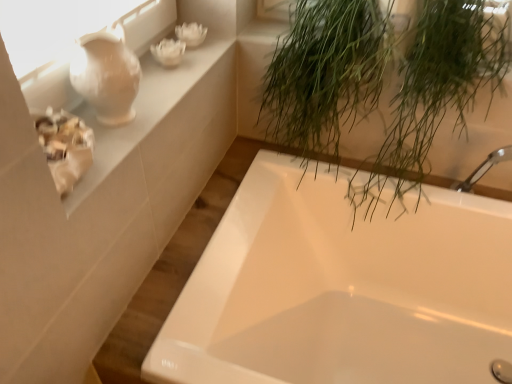
Question: Considering the relative sizes of matte white vase at upper left and white glossy bathtub at center in the image provided, is matte white vase at upper left taller than white glossy bathtub at center?

Choices:
 (A) yes
 (B) no

Answer: (B)

Question: From the image's perspective, is matte white vase at upper left located above white glossy bathtub at center?

Choices:
 (A) no
 (B) yes

Answer: (B)

Question: Is matte white vase at upper left to the right of white glossy bathtub at center from the viewer's perspective?

Choices:
 (A) yes
 (B) no

Answer: (B)

Question: Does matte white vase at upper left have a lesser height compared to white glossy bathtub at center?

Choices:
 (A) no
 (B) yes

Answer: (B)

Question: Is matte white vase at upper left smaller than white glossy bathtub at center?

Choices:
 (A) no
 (B) yes

Answer: (B)

Question: In the image, is white glossy bathtub at center positioned in front of or behind white ceramic vase at upper left?

Choices:
 (A) behind
 (B) front

Answer: (B)

Question: Considering the positions of white glossy bathtub at center and white ceramic vase at upper left in the image, is white glossy bathtub at center taller or shorter than white ceramic vase at upper left?

Choices:
 (A) short
 (B) tall

Answer: (B)

Question: Looking at the image, does white glossy bathtub at center seem bigger or smaller compared to white ceramic vase at upper left?

Choices:
 (A) small
 (B) big

Answer: (B)

Question: From the image's perspective, is white glossy bathtub at center above or below white ceramic vase at upper left?

Choices:
 (A) above
 (B) below

Answer: (B)

Question: From a real-world perspective, is green leafy plant at upper right positioned above or below white ceramic vase at upper left?

Choices:
 (A) below
 (B) above

Answer: (A)

Question: In terms of height, does green leafy plant at upper right look taller or shorter compared to white ceramic vase at upper left?

Choices:
 (A) tall
 (B) short

Answer: (A)

Question: Looking at their shapes, would you say green leafy plant at upper right is wider or thinner than white ceramic vase at upper left?

Choices:
 (A) thin
 (B) wide

Answer: (B)

Question: Looking at the image, does green leafy plant at upper right seem bigger or smaller compared to white ceramic vase at upper left?

Choices:
 (A) small
 (B) big

Answer: (B)

Question: Looking at the image, does white glossy bathtub at center seem bigger or smaller compared to matte white vase at upper left?

Choices:
 (A) small
 (B) big

Answer: (B)

Question: In terms of height, does white glossy bathtub at center look taller or shorter compared to matte white vase at upper left?

Choices:
 (A) tall
 (B) short

Answer: (A)